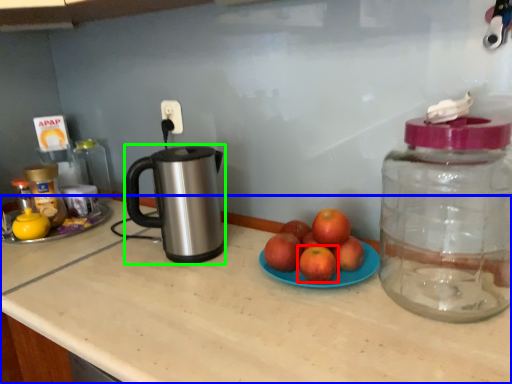
Question: Based on their relative distances, which object is farther from grapefruit (highlighted by a red box)? Choose from countertop (highlighted by a blue box) and kettle (highlighted by a green box).

Choices:
 (A) countertop
 (B) kettle

Answer: (B)